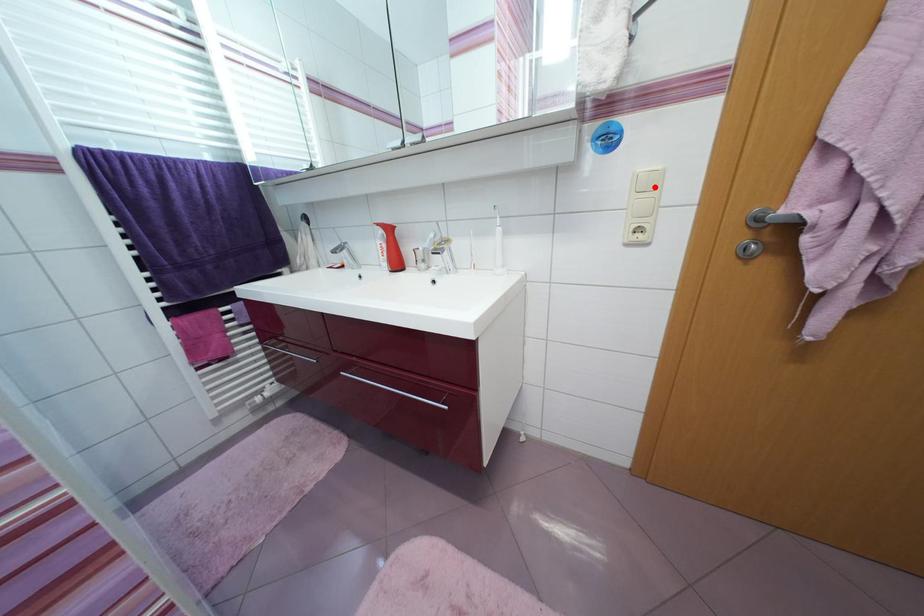
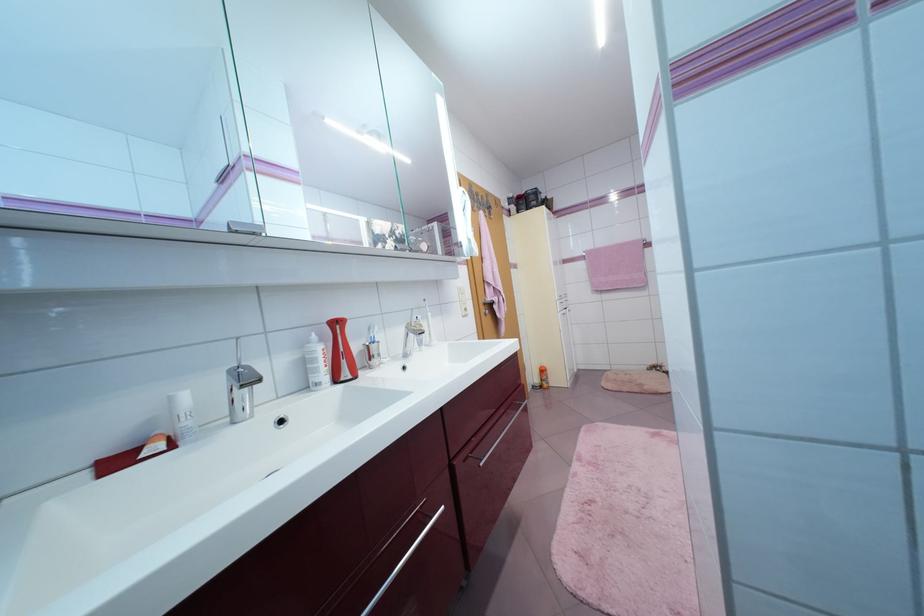
Question: I am providing you with two images of the same scene from different viewpoints. A red point is marked on the first image. Can you still see the location of the red point in image 2?

Choices:
 (A) Yes
 (B) No

Answer: (B)